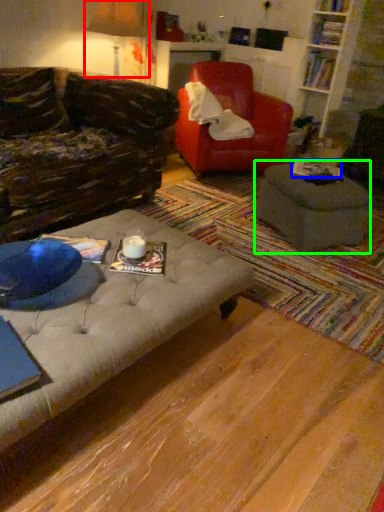
Question: Estimate the real-world distances between objects in this image. Which object is closer to table lamp (highlighted by a red box), book (highlighted by a blue box) or table (highlighted by a green box)?

Choices:
 (A) book
 (B) table

Answer: (A)